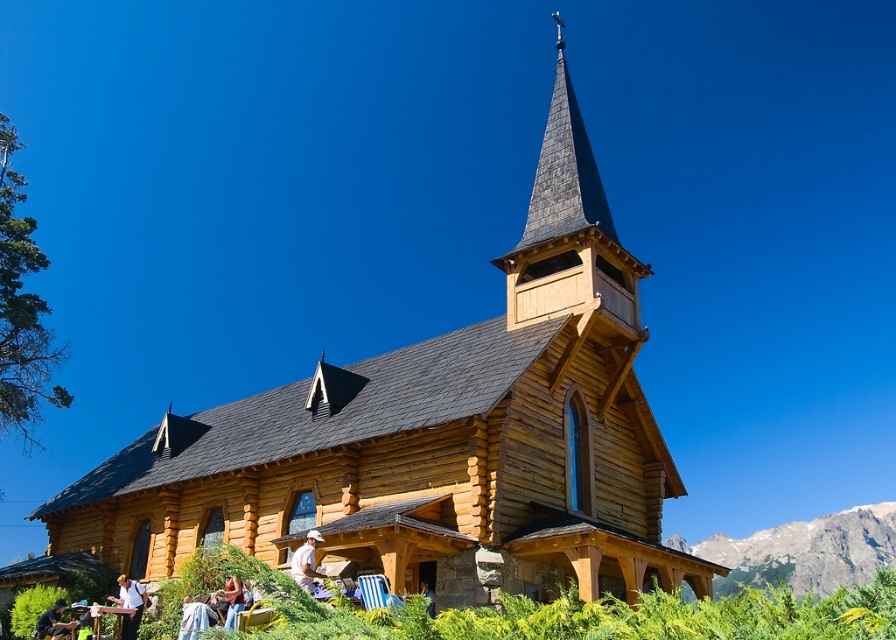
Is green leafy hillside at lower right further to the viewer compared to white cotton shirt at lower center?

Yes, green leafy hillside at lower right is further from the viewer.

Between green leafy hillside at lower right and white cotton shirt at lower center, which one appears on the right side from the viewer's perspective?

green leafy hillside at lower right

Identify the location of green leafy hillside at lower right. (804, 552).

Which of these two, white shirt at lower left or denim jacket at lower left, stands taller?

With more height is white shirt at lower left.

Between white shirt at lower left and denim jacket at lower left, which one is positioned higher?

Positioned higher is white shirt at lower left.

Is point (135, 630) closer to camera compared to point (59, 632)?

Yes, point (135, 630) is closer to viewer.

In order to click on white shirt at lower left in this screenshot , I will do `click(128, 604)`.

Is point (583, 200) closer to viewer compared to point (826, 516)?

Yes, point (583, 200) is in front of point (826, 516).

Measure the distance between point (x=645, y=266) and camera.

The distance of point (x=645, y=266) from camera is 49.07 meters.

Does point (583, 134) come behind point (808, 536)?

No, it is not.

Where is `wooden shingles steeple at upper center`? wooden shingles steeple at upper center is located at coordinates (570, 236).